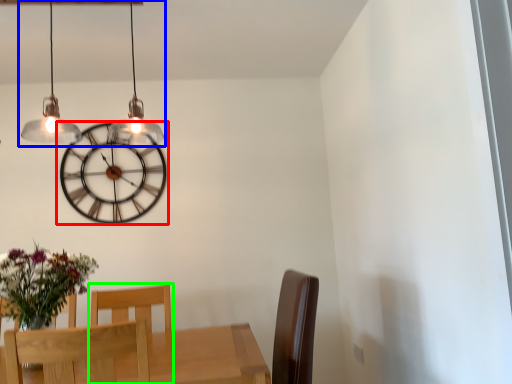
Question: Estimate the real-world distances between objects in this image. Which object is closer to wall clock (highlighted by a red box), lamp (highlighted by a blue box) or chair (highlighted by a green box)?

Choices:
 (A) lamp
 (B) chair

Answer: (A)